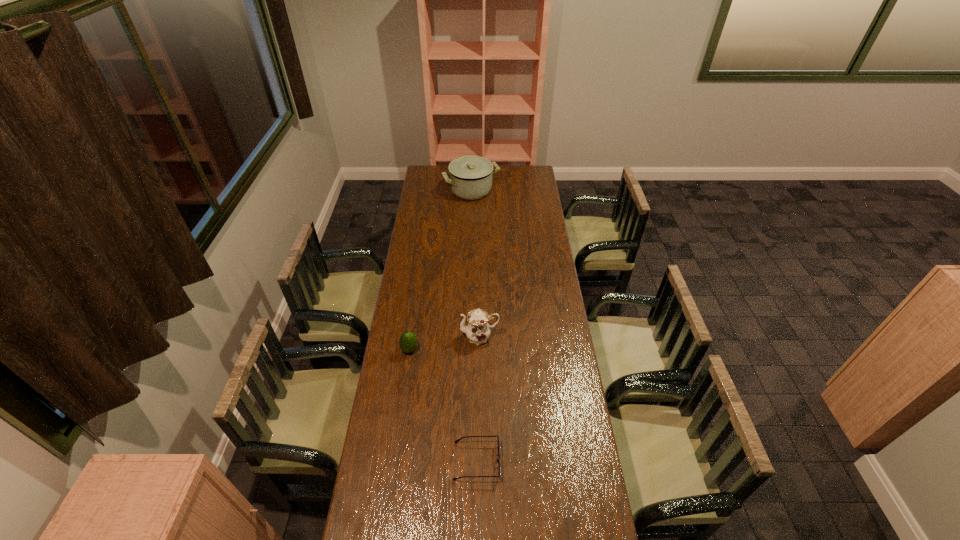
Where is `object that is at the far edge`? Image resolution: width=960 pixels, height=540 pixels. object that is at the far edge is located at coordinates (470, 177).

Locate an element on the screen. The width and height of the screenshot is (960, 540). saucepan present at the left edge is located at coordinates (470, 177).

The width and height of the screenshot is (960, 540). Find the location of `avocado positioned at the left edge`. avocado positioned at the left edge is located at coordinates (408, 342).

Locate an element on the screen. object located at the far left corner is located at coordinates (470, 177).

Find the location of a particular element. free space at the far edge of the desktop is located at coordinates (448, 185).

In the image, there is a desktop. Identify the location of vacant space at the left edge. (392, 467).

Identify the location of blank space at the right edge. The width and height of the screenshot is (960, 540). (580, 417).

You are a GUI agent. You are given a task and a screenshot of the screen. Output one action in this format:
    pyautogui.click(x=<x>, y=<y>)
    Task: Click on the vacant region at the far left corner of the desktop
    
    Given the screenshot: What is the action you would take?
    (441, 168)

The height and width of the screenshot is (540, 960). I want to click on vacant area between the chinaware and the spectacles, so click(x=478, y=399).

Locate an element on the screen. The height and width of the screenshot is (540, 960). free space between the avocado and the chinaware is located at coordinates (444, 343).